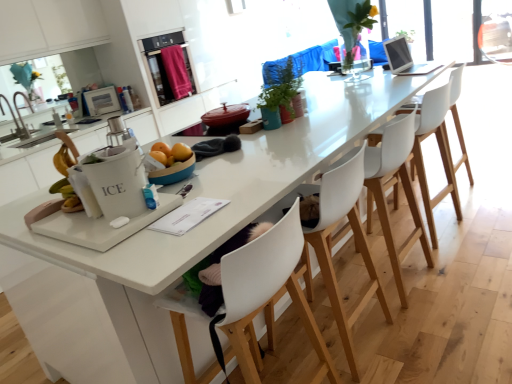
Question: Does silver metallic laptop at upper right, placed as the third appliance when sorted from bottom to top, appear on the left side of white plastic chair at center, which appears as the fourth chair when viewed from the back?

Choices:
 (A) yes
 (B) no

Answer: (B)

Question: Is silver metallic laptop at upper right, the second appliance positioned from the front, outside of white plastic chair at center, which appears as the second chair when viewed from the front?

Choices:
 (A) no
 (B) yes

Answer: (B)

Question: Are silver metallic laptop at upper right, placed as the 1th appliance when sorted from right to left, and white plastic chair at center, which appears as the second chair when viewed from the front, located far from each other?

Choices:
 (A) no
 (B) yes

Answer: (B)

Question: Does silver metallic laptop at upper right, the second appliance positioned from the front, have a lesser height compared to white plastic chair at center, which appears as the fourth chair when viewed from the back?

Choices:
 (A) no
 (B) yes

Answer: (B)

Question: Is silver metallic laptop at upper right, marked as the 3th appliance in a left-to-right arrangement, taller than white plastic chair at center, which appears as the fourth chair when viewed from the back?

Choices:
 (A) yes
 (B) no

Answer: (B)

Question: Is silver metallic laptop at upper right, the second appliance positioned from the front, smaller than white plastic chair at center, which appears as the second chair when viewed from the front?

Choices:
 (A) yes
 (B) no

Answer: (A)

Question: Is white plastic chair at center, which appears as the fourth chair when viewed from the back, in front of white plastic chair at right, placed as the first chair when sorted from back to front?

Choices:
 (A) yes
 (B) no

Answer: (A)

Question: From a real-world perspective, does white plastic chair at center, which appears as the fourth chair when viewed from the back, stand above white plastic chair at right, the 5th chair in the front-to-back sequence?

Choices:
 (A) no
 (B) yes

Answer: (A)

Question: Considering the relative sizes of white plastic chair at center, which appears as the second chair when viewed from the front, and white plastic chair at right, the 5th chair in the front-to-back sequence, in the image provided, is white plastic chair at center, which appears as the second chair when viewed from the front, bigger than white plastic chair at right, the 5th chair in the front-to-back sequence,?

Choices:
 (A) no
 (B) yes

Answer: (A)

Question: Does white plastic chair at center, which appears as the fourth chair when viewed from the back, have a greater width compared to white plastic chair at right, placed as the first chair when sorted from back to front?

Choices:
 (A) no
 (B) yes

Answer: (A)

Question: Could you tell me if white plastic chair at center, which appears as the second chair when viewed from the front, is facing white plastic chair at right, the 5th chair in the front-to-back sequence?

Choices:
 (A) no
 (B) yes

Answer: (A)

Question: Is white plastic chair at center, which appears as the fourth chair when viewed from the back, smaller than white plastic chair at right, placed as the first chair when sorted from back to front?

Choices:
 (A) yes
 (B) no

Answer: (A)

Question: Is brushed metal faucet at left behind white plastic chair at center, which is the 3th chair from back to front?

Choices:
 (A) yes
 (B) no

Answer: (A)